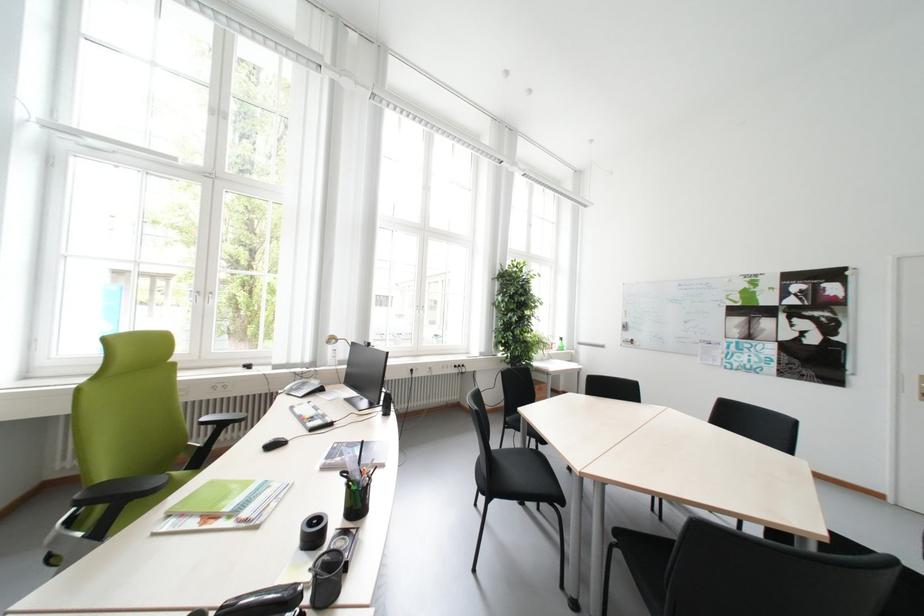
Find the location of `green chair sitting surface`. green chair sitting surface is located at coordinates (120, 490).